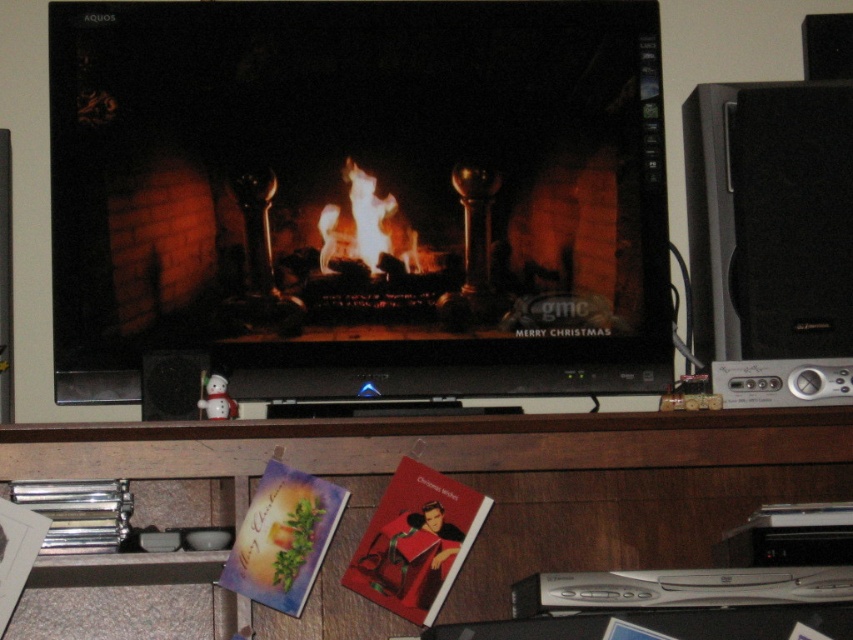
You are an interior designer trying to place a new painting exactly at the center of the wall where the matte black fireplace at center is located. Given the coordinates provided, where should you position the painting?

The painting should be placed at the coordinates (360, 196) to align with the center of the matte black fireplace at center.

You are standing in front of the TV shelf and want to place a small ornament between the two points labeled point (x=633, y=257) and point (x=361, y=236). Which point should you move towards to position the ornament closer to the camera?

You should move towards point (x=633, y=257) because it is further to the camera than point (x=361, y=236), so placing the ornament there will be closer to you.